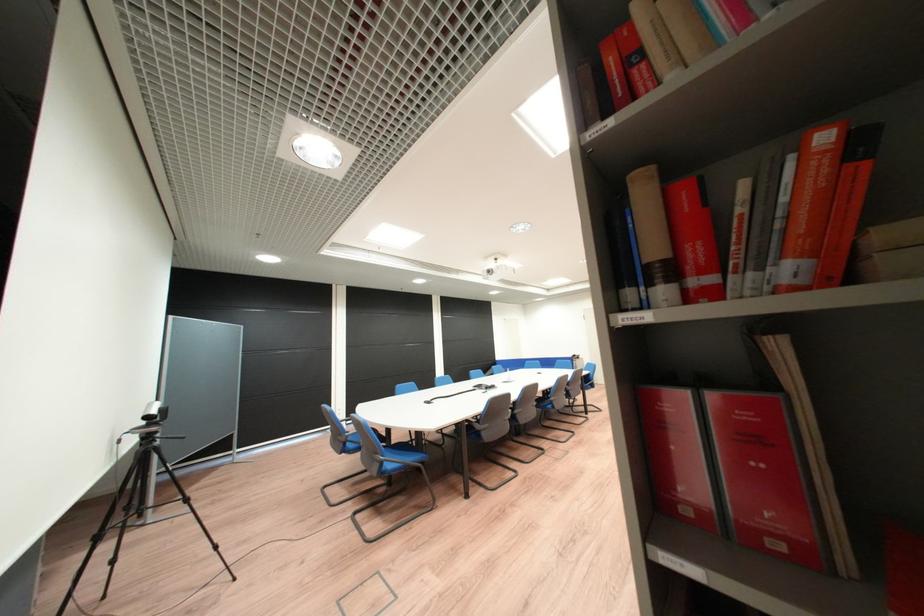
The image size is (924, 616). What do you see at coordinates (405, 469) in the screenshot?
I see `a chair armrest` at bounding box center [405, 469].